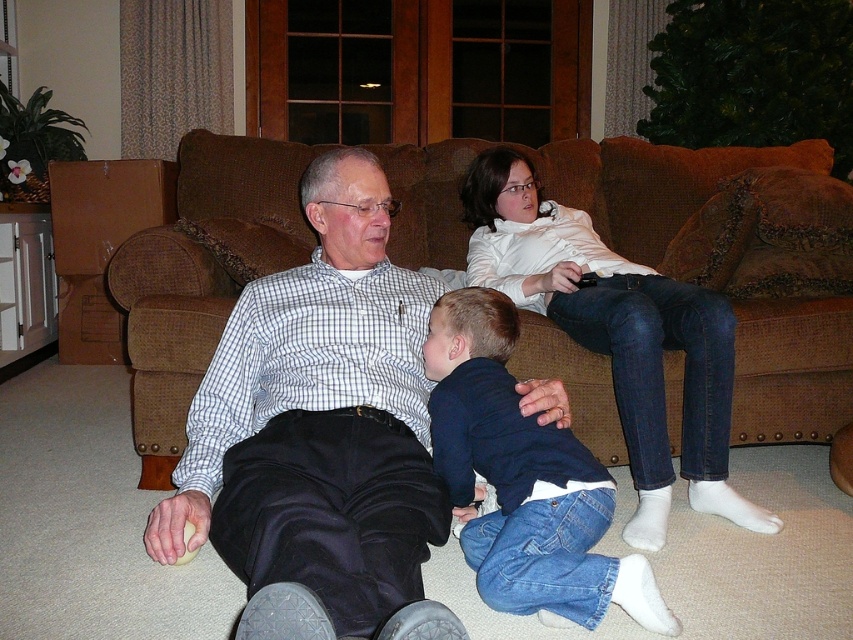
Question: Is brown fabric couch at center above dark blue denim jeans at lower center?

Choices:
 (A) no
 (B) yes

Answer: (B)

Question: Based on their relative distances, which object is nearer to the white checkered shirt at center?

Choices:
 (A) white matte shirt at upper center
 (B) dark blue denim jeans at lower center

Answer: (B)

Question: From the image, what is the correct spatial relationship of white checkered shirt at center in relation to brown fabric couch at center?

Choices:
 (A) right
 (B) left

Answer: (B)

Question: Can you confirm if brown fabric couch at center is positioned above white matte shirt at upper center?

Choices:
 (A) yes
 (B) no

Answer: (A)

Question: Which point is farther from the camera taking this photo?

Choices:
 (A) (244, 368)
 (B) (685, 404)
 (C) (666, 248)
 (D) (572, 554)

Answer: (C)

Question: Which point is farther from the camera taking this photo?

Choices:
 (A) (599, 272)
 (B) (286, 294)
 (C) (544, 372)

Answer: (A)